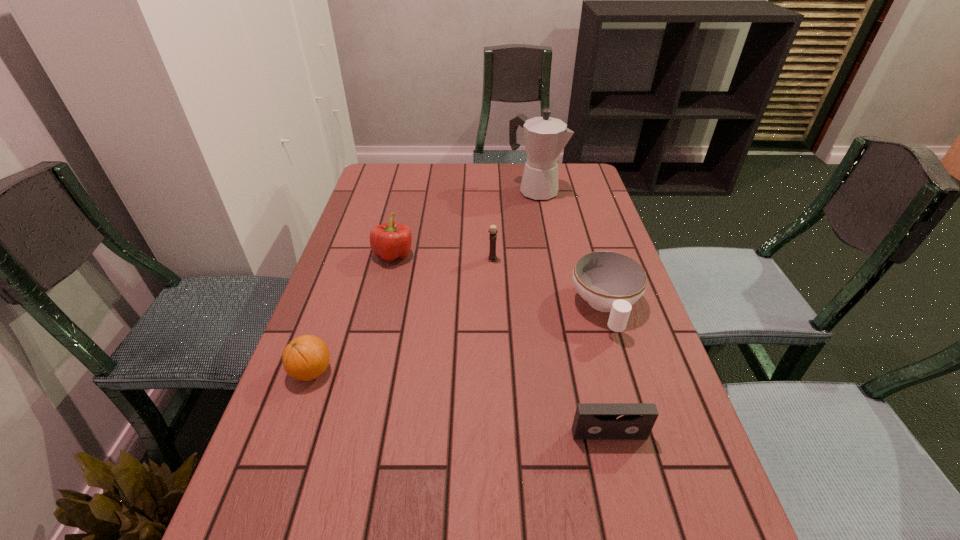
Locate an element on the screen. object that is at the far right corner is located at coordinates (545, 137).

Where is `free location at the far edge of the desktop`? The image size is (960, 540). free location at the far edge of the desktop is located at coordinates (453, 186).

Where is `free space at the left edge`? free space at the left edge is located at coordinates (365, 384).

This screenshot has width=960, height=540. I want to click on vacant area at the right edge of the desktop, so click(x=682, y=440).

What are the coordinates of `unoccupied area between the bell pepper and the farthest object` in the screenshot? It's located at (465, 223).

The image size is (960, 540). I want to click on free space between the orange and the farthest object, so click(423, 281).

Where is `free space that is in between the fifth object from right to left and the fifth farthest object`? The width and height of the screenshot is (960, 540). free space that is in between the fifth object from right to left and the fifth farthest object is located at coordinates (352, 313).

Find the location of a particular element. This screenshot has height=540, width=960. free space between the candle holder and the chinaware is located at coordinates (549, 283).

Locate an element on the screen. The height and width of the screenshot is (540, 960). free spot between the orange and the fifth object from right to left is located at coordinates (352, 313).

You are a GUI agent. You are given a task and a screenshot of the screen. Output one action in this format:
    pyautogui.click(x=<x>, y=<y>)
    Task: Click on the vacant region between the videotape and the chinaware
    
    Given the screenshot: What is the action you would take?
    pyautogui.click(x=608, y=370)